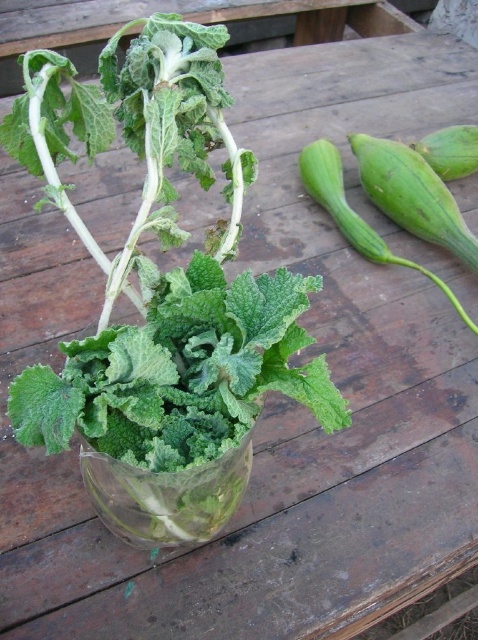
You are a delivery person who needs to place a package on the wooden surface in the image. The package requires a stable spot that is not occupied by any objects. Can you place it near the transparent glass vase at center?

The transparent glass vase at center is located at point (165, 497). Since there are no other objects mentioned near this position, you can safely place the package there as long as it doesn

You are arranging flowers in a rustic outdoor setting. You have a transparent glass vase at center and a green smooth squash at right. Which object should you place closer to the edge of the wooden surface to ensure stability?

The transparent glass vase at center is smaller than the green smooth squash at right, so placing the green smooth squash at right closer to the edge would provide better stability due to its larger size and weight.